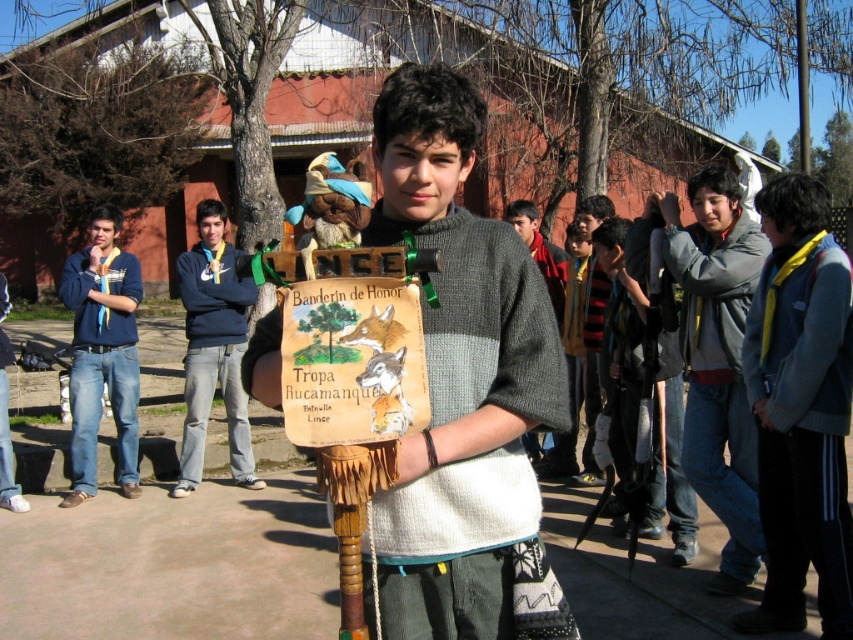
Between knitted sweater at center and blue sweatshirt at center, which one appears on the left side from the viewer's perspective?

Positioned to the left is blue sweatshirt at center.

Is point (537, 305) closer to camera compared to point (184, 456)?

Yes, point (537, 305) is in front of point (184, 456).

Image resolution: width=853 pixels, height=640 pixels. Find the location of `knitted sweater at center`. knitted sweater at center is located at coordinates (461, 380).

Looking at this image, between yellow fabric scarf at right and blue denim jeans at left, which one is positioned higher?

blue denim jeans at left is above.

Can you confirm if yellow fabric scarf at right is positioned to the right of blue denim jeans at left?

Correct, you'll find yellow fabric scarf at right to the right of blue denim jeans at left.

I want to click on yellow fabric scarf at right, so click(x=801, y=410).

You are a GUI agent. You are given a task and a screenshot of the screen. Output one action in this format:
    pyautogui.click(x=<x>, y=<y>)
    Task: Click on the yellow fabric scarf at right
    The height and width of the screenshot is (640, 853).
    Given the screenshot: What is the action you would take?
    pyautogui.click(x=801, y=410)

Is knitted sweater at center above blue denim jeans at left?

Yes.

Who is more distant from viewer, (x=418, y=476) or (x=80, y=355)?

The point (x=80, y=355) is behind.

Find the location of a particular element. knitted sweater at center is located at coordinates (461, 380).